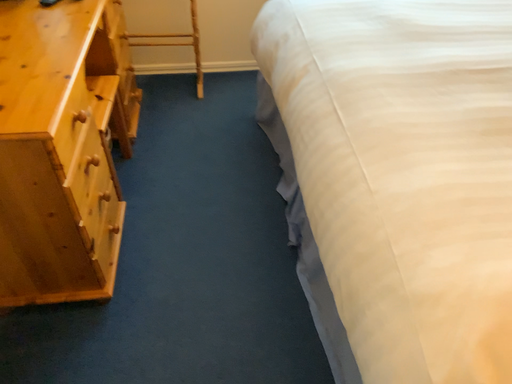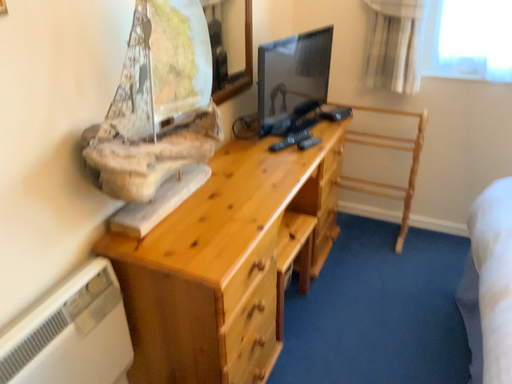
Question: How did the camera likely rotate when shooting the video?

Choices:
 (A) rotated upward
 (B) rotated downward

Answer: (A)